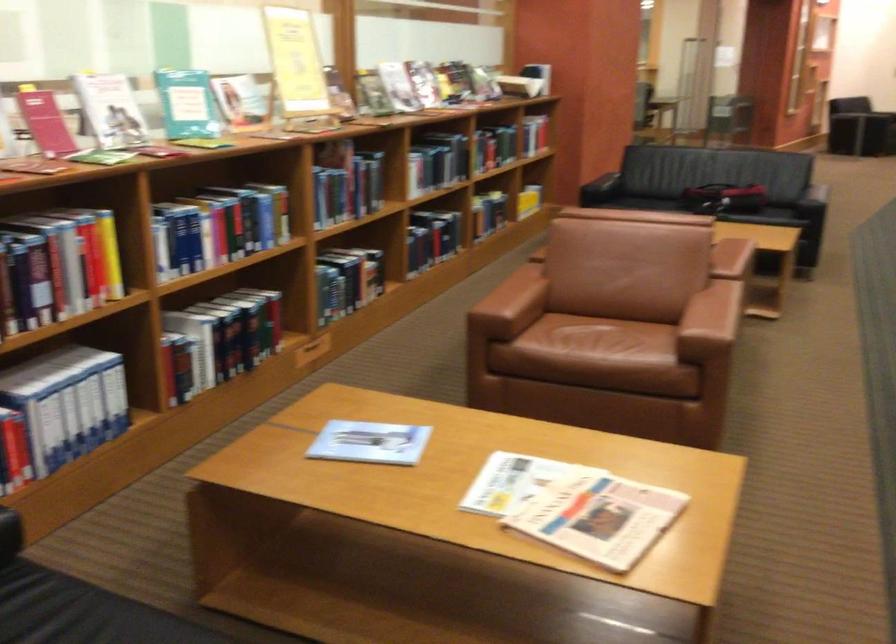
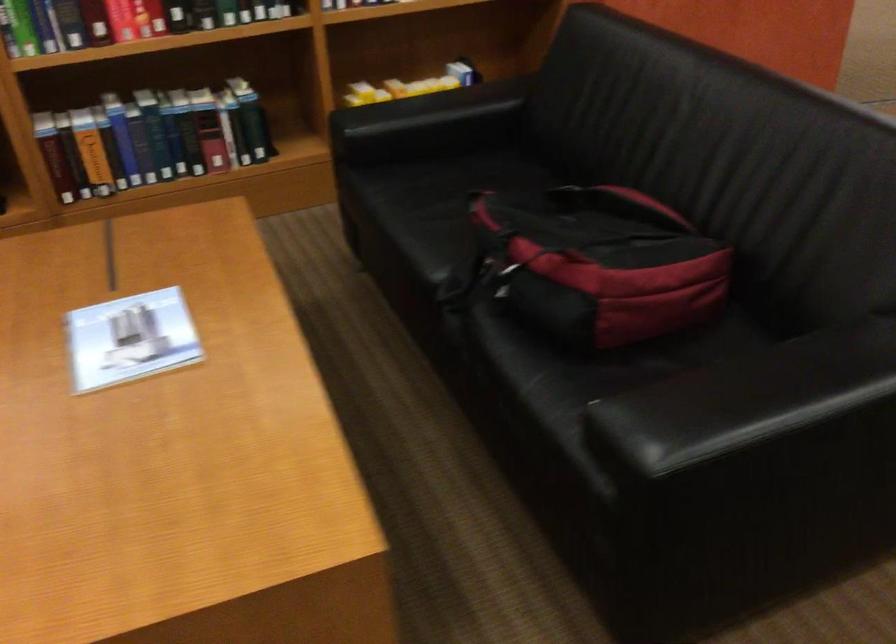
Find the pixel in the second image that matches (718,192) in the first image.

(495, 269)